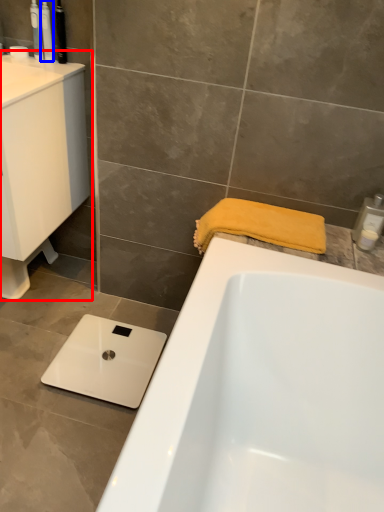
Question: Which of the following is the farthest to the observer, sink (highlighted by a red box) or toiletry (highlighted by a blue box)?

Choices:
 (A) sink
 (B) toiletry

Answer: (B)